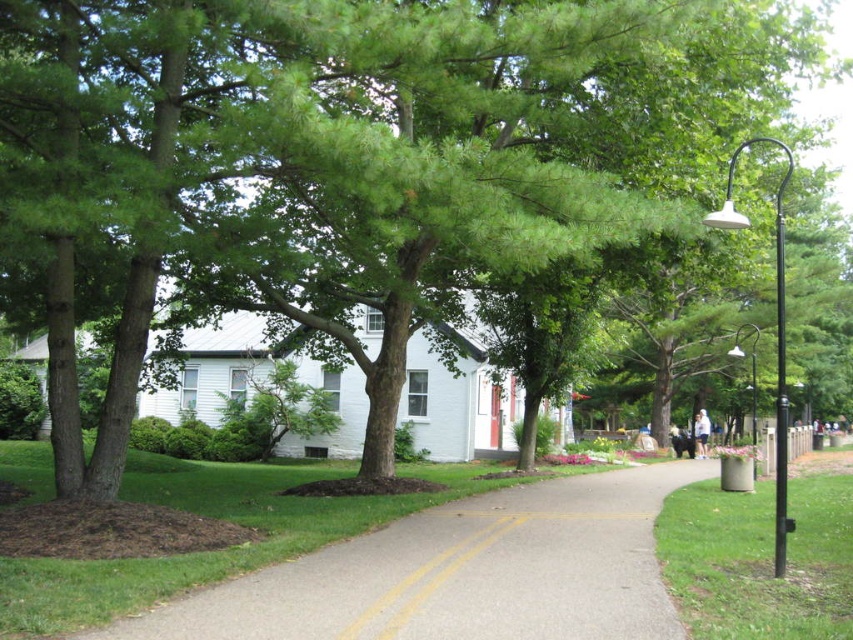
Question: Is gray asphalt pavement at center thinner than yellow asphalt road at center?

Choices:
 (A) yes
 (B) no

Answer: (B)

Question: Which point is farther to the camera?

Choices:
 (A) (778, 308)
 (B) (421, 589)
 (C) (424, 554)

Answer: (A)

Question: Is yellow asphalt road at center to the right of black metal lamp post at right from the viewer's perspective?

Choices:
 (A) no
 (B) yes

Answer: (A)

Question: Is gray asphalt pavement at center positioned before black metal lamp post at right?

Choices:
 (A) no
 (B) yes

Answer: (B)

Question: Which point appears farthest from the camera in this image?

Choices:
 (A) (364, 618)
 (B) (746, 140)
 (C) (320, 625)

Answer: (B)

Question: Which of these objects is positioned closest to the yellow asphalt road at center?

Choices:
 (A) gray asphalt pavement at center
 (B) black metal lamp post at right

Answer: (A)